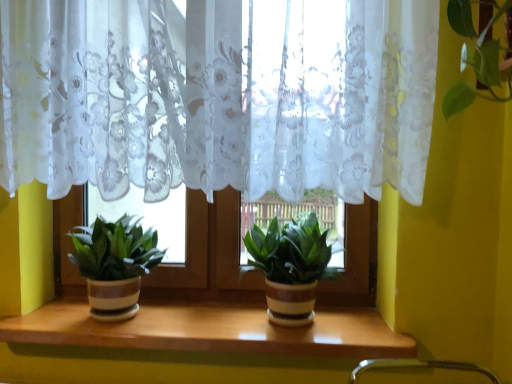
Identify the location of vacant space underneath green matte plant pot at center, positioned as the 2th houseplant in left-to-right order (from a real-world perspective). Image resolution: width=512 pixels, height=384 pixels. (286, 327).